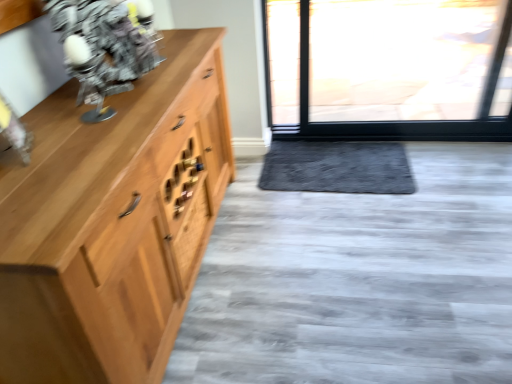
I want to click on wooden drawer at center, so click(191, 232).

Locate an element on the screen. The height and width of the screenshot is (384, 512). gray plush doormat at center is located at coordinates (337, 167).

Could you tell me if wooden drawer at center is facing metallic silver robot at upper left?

No, wooden drawer at center does not turn towards metallic silver robot at upper left.

Between point (193, 194) and point (106, 38), which one is positioned behind?

The point (193, 194) is farther.

Is wooden drawer at center outside of metallic silver robot at upper left?

Absolutely, wooden drawer at center is external to metallic silver robot at upper left.

Which of these two, gray plush doormat at center or wooden drawer at center, is smaller?

wooden drawer at center is smaller.

Is gray plush doormat at center far from wooden drawer at center?

gray plush doormat at center is actually quite close to wooden drawer at center.

From a real-world perspective, is gray plush doormat at center above or below wooden drawer at center?

gray plush doormat at center is situated lower than wooden drawer at center in the real world.

Could metallic silver robot at upper left be considered to be inside gray plush doormat at center?

No, metallic silver robot at upper left is located outside of gray plush doormat at center.

What are the coordinates of `doormat that appears below the metallic silver robot at upper left (from the image's perspective)` in the screenshot? It's located at (337, 167).

Would you say gray plush doormat at center is a long distance from metallic silver robot at upper left?

gray plush doormat at center is positioned a significant distance from metallic silver robot at upper left.

Is gray plush doormat at center at the back of metallic silver robot at upper left?

No, metallic silver robot at upper left is not facing away from gray plush doormat at center.

From a real-world perspective, is metallic silver robot at upper left on gray plush doormat at center?

Yes, from a real-world perspective, metallic silver robot at upper left is above gray plush doormat at center.

Is metallic silver robot at upper left bigger or smaller than wooden drawer at center?

Considering their sizes, metallic silver robot at upper left takes up more space than wooden drawer at center.

From a real-world perspective, is metallic silver robot at upper left over wooden drawer at center?

Yes.

You are a GUI agent. You are given a task and a screenshot of the screen. Output one action in this format:
    pyautogui.click(x=<x>, y=<y>)
    Task: Click on the figurine above the wooden drawer at center (from the image's perspective)
    
    Given the screenshot: What is the action you would take?
    pyautogui.click(x=104, y=47)

Can you confirm if metallic silver robot at upper left is shorter than wooden drawer at center?

Incorrect, the height of metallic silver robot at upper left does not fall short of that of wooden drawer at center.

Which of these two, wooden drawer at center or gray plush doormat at center, is thinner?

With smaller width is wooden drawer at center.

Considering the positions of objects wooden drawer at center and gray plush doormat at center in the image provided, who is more to the right, wooden drawer at center or gray plush doormat at center?

Positioned to the right is gray plush doormat at center.

Which is behind, point (196, 199) or point (303, 143)?

Positioned behind is point (303, 143).

From the image's perspective, who appears lower, wooden drawer at center or gray plush doormat at center?

wooden drawer at center.

There is a wooden drawer at center. Identify the location of figurine above it (from a real-world perspective). Image resolution: width=512 pixels, height=384 pixels. (104, 47).

The width and height of the screenshot is (512, 384). I want to click on drawer on the left of gray plush doormat at center, so click(x=191, y=232).

Estimate the real-world distances between objects in this image. Which object is closer to wooden drawer at center, metallic silver robot at upper left or gray plush doormat at center?

metallic silver robot at upper left is closer to wooden drawer at center.

From the picture: Which object lies further to the anchor point wooden drawer at center, gray plush doormat at center or metallic silver robot at upper left?

gray plush doormat at center is further to wooden drawer at center.

Based on their spatial positions, is wooden drawer at center or metallic silver robot at upper left closer to gray plush doormat at center?

wooden drawer at center is positioned closer to the anchor gray plush doormat at center.

From the image, which object appears to be nearer to metallic silver robot at upper left, wooden drawer at center or gray plush doormat at center?

Among the two, wooden drawer at center is located nearer to metallic silver robot at upper left.

In the scene shown: Which object lies nearer to the anchor point gray plush doormat at center, metallic silver robot at upper left or wooden drawer at center?

The object closer to gray plush doormat at center is wooden drawer at center.

From the image, which object appears to be nearer to metallic silver robot at upper left, gray plush doormat at center or wooden drawer at center?

wooden drawer at center is closer to metallic silver robot at upper left.

Locate an element on the screen. drawer between metallic silver robot at upper left and gray plush doormat at center along the z-axis is located at coordinates click(191, 232).